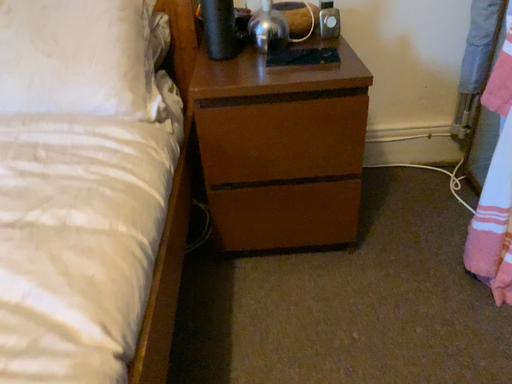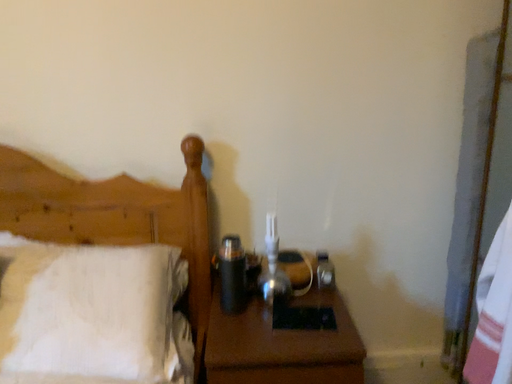
Question: How did the camera likely rotate when shooting the video?

Choices:
 (A) rotated downward
 (B) rotated upward

Answer: (B)